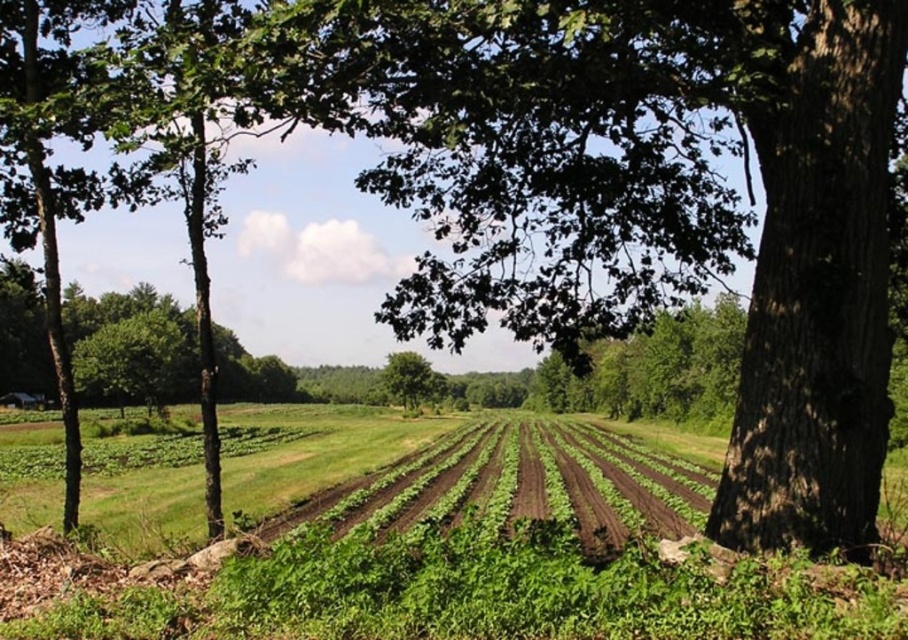
Question: Is green leafy plants at center smaller than green leafy tree at center?

Choices:
 (A) no
 (B) yes

Answer: (A)

Question: Which point is closer to the camera taking this photo?

Choices:
 (A) (423, 392)
 (B) (464, 493)
 (C) (588, 480)

Answer: (B)

Question: Does green leafy grass at center have a greater width compared to green leafy tree at center?

Choices:
 (A) yes
 (B) no

Answer: (A)

Question: Among these points, which one is farthest from the camera?

Choices:
 (A) (400, 388)
 (B) (282, 596)
 (C) (707, 500)

Answer: (A)

Question: Which of the following is the farthest from the observer?

Choices:
 (A) green leafy plants at center
 (B) green leafy tree at center
 (C) green leafy grass at center

Answer: (B)

Question: Considering the relative positions of green leafy grass at center and green leafy plants at center in the image provided, where is green leafy grass at center located with respect to green leafy plants at center?

Choices:
 (A) right
 (B) left

Answer: (B)